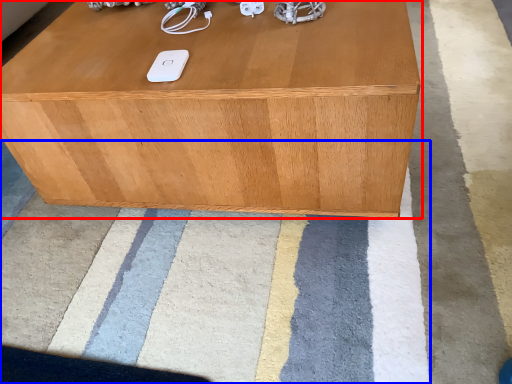
Question: Which object appears farthest to the camera in this image, table (highlighted by a red box) or mat (highlighted by a blue box)?

Choices:
 (A) table
 (B) mat

Answer: (A)